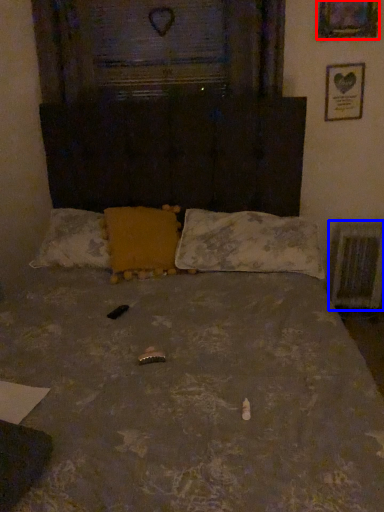
Question: Which object appears farthest to the camera in this image, picture frame (highlighted by a red box) or radiator (highlighted by a blue box)?

Choices:
 (A) picture frame
 (B) radiator

Answer: (B)